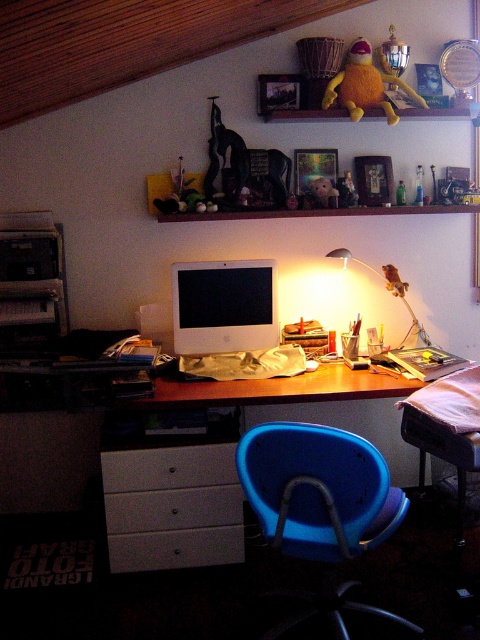
Does blue plastic swivel chair at center appear on the left side of white matte drawer at lower center?

Incorrect, blue plastic swivel chair at center is not on the left side of white matte drawer at lower center.

Is point (305, 433) positioned after point (109, 513)?

No, (305, 433) is closer to viewer.

At what (x,y) coordinates should I click in order to perform the action: click on blue plastic swivel chair at center. Please return your answer as a coordinate pair (x, y). This screenshot has height=640, width=480. Looking at the image, I should click on (320, 506).

Measure the distance between matte white monitor at center and camera.

matte white monitor at center is 2.64 meters from camera.

Is matte white monitor at center positioned in front of white glossy drawer at lower center?

No, matte white monitor at center is further to the viewer.

Describe the element at coordinates (224, 307) in the screenshot. I see `matte white monitor at center` at that location.

Find the location of `matte white monitor at center`. matte white monitor at center is located at coordinates (224, 307).

This screenshot has width=480, height=640. I want to click on white matte computer desk at center, so click(x=171, y=506).

Does white matte computer desk at center have a smaller size compared to metallic silver desk lamp at center-right?

No.

Does point (227, 540) come closer to viewer compared to point (392, 289)?

Yes, point (227, 540) is closer to viewer.

Identify the location of white matte computer desk at center. (171, 506).